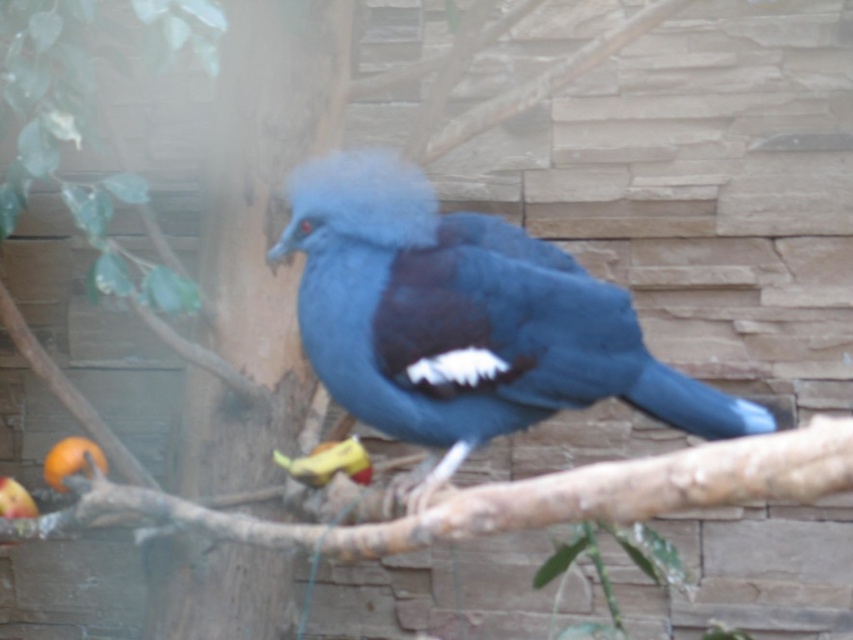
You are observing a bird in an enclosure. There are two points marked in the image. The first point is at coordinates point (351, 509) and the second point is at point (294, 472). Which of these two points is nearer to you?

Point (351, 509) is closer to the viewer than point (294, 472).

You are a zookeeper who needs to place a new feeding tray for the shiny blue parrot at center. The tray requires a surface larger than the parrot itself. Can the brown rough wood at lower center accommodate the feeding tray?

The brown rough wood at lower center is bigger than the shiny blue parrot at center, so yes, the feeding tray can be placed there since the surface is large enough.

Consider the image. You are a visitor at the zoo and see the bird on the branch. You notice a brown rough wood at lower center and a matte orange fruit at lower left. Which object is positioned to the right of the other?

The brown rough wood at lower center is to the right of matte orange fruit at lower left.